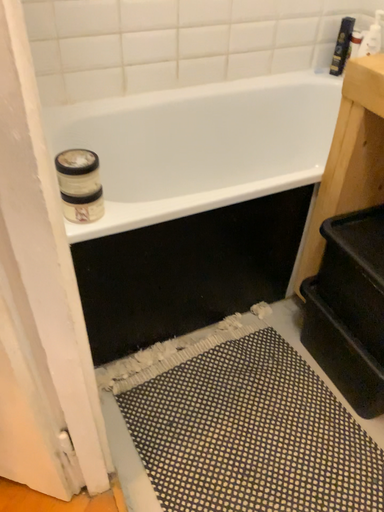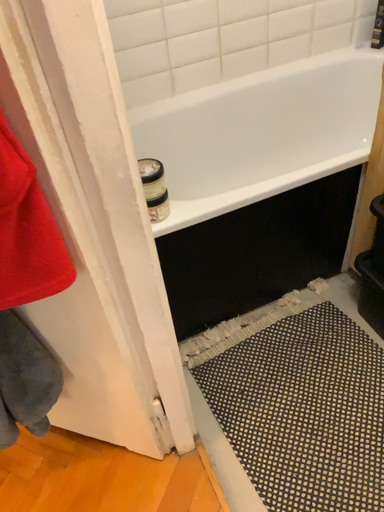
Question: How did the camera likely rotate when shooting the video?

Choices:
 (A) rotated right
 (B) rotated left

Answer: (B)